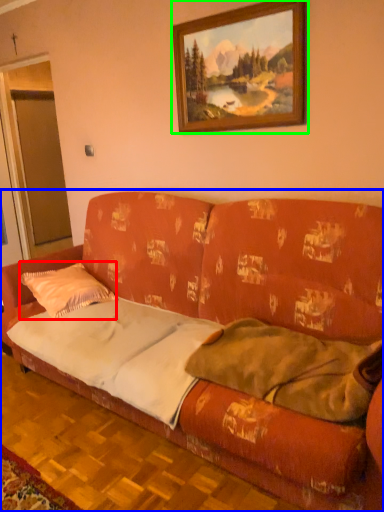
Question: Which object is the closest to the throw pillow (highlighted by a red box)? Choose among these: studio couch (highlighted by a blue box) or picture frame (highlighted by a green box).

Choices:
 (A) studio couch
 (B) picture frame

Answer: (A)